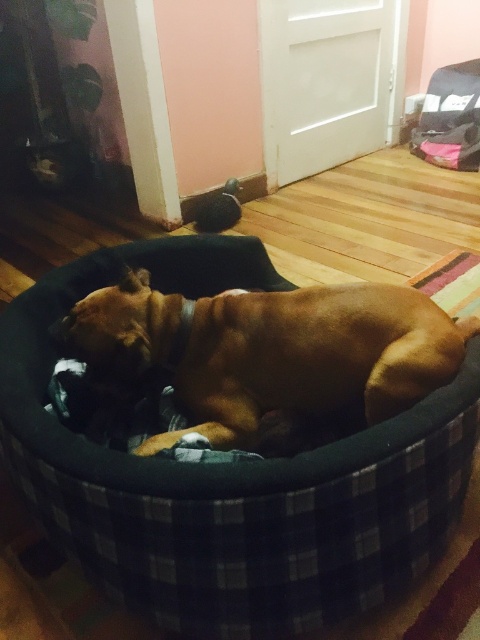
Is black plaid dog bed at center positioned before brown velvety dog at center?

Yes, it is in front of brown velvety dog at center.

Between black plaid dog bed at center and brown velvety dog at center, which one has less height?

Standing shorter between the two is brown velvety dog at center.

Measure the distance between point (433, 419) and camera.

The distance of point (433, 419) from camera is 1.06 meters.

Find the location of a particular element. black plaid dog bed at center is located at coordinates (230, 477).